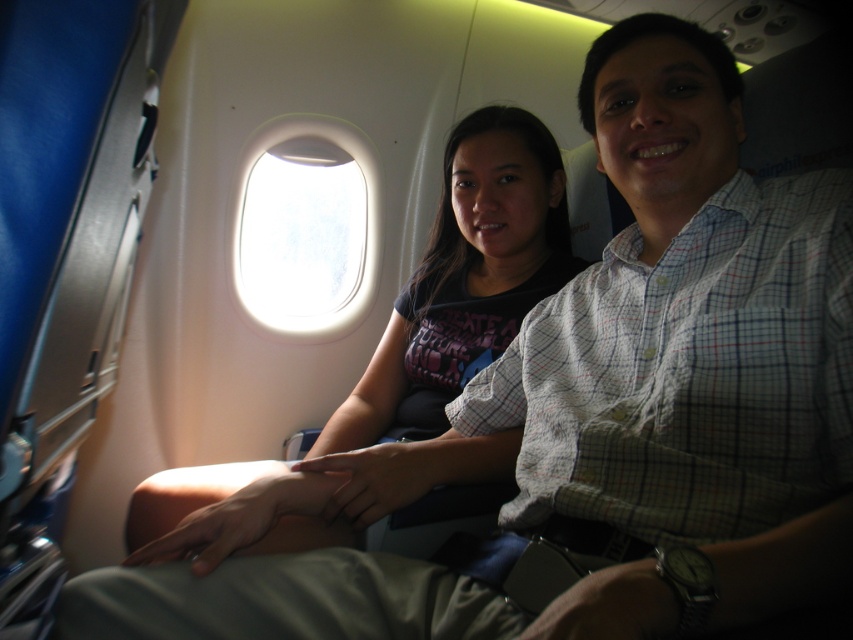
Is matte black shirt at center closer to the viewer compared to transparent glass airplane window at center?

That is True.

Who is more distant from viewer, (405, 353) or (363, 152)?

The point (363, 152) is more distant.

Is point (547, 276) positioned after point (338, 305)?

No, it is not.

Image resolution: width=853 pixels, height=640 pixels. Identify the location of matte black shirt at center. (466, 275).